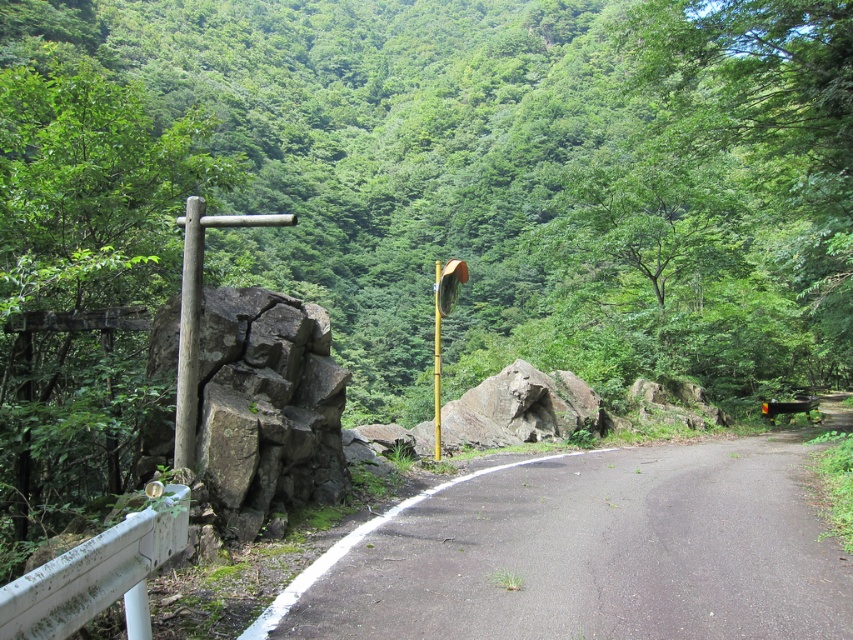
Question: Which of the following is the closest to the observer?

Choices:
 (A) (167, 348)
 (B) (439, 268)

Answer: (A)

Question: Among these objects, which one is nearest to the camera?

Choices:
 (A) smooth wooden post at left
 (B) black asphalt road at center

Answer: (B)

Question: Is brown wooden pole at left positioned before smooth wooden post at left?

Choices:
 (A) yes
 (B) no

Answer: (A)

Question: Can you confirm if black asphalt road at center is thinner than smooth wooden post at left?

Choices:
 (A) no
 (B) yes

Answer: (A)

Question: Can you confirm if brown wooden pole at left is positioned above smooth wooden post at left?

Choices:
 (A) no
 (B) yes

Answer: (B)

Question: Which point is closer to the camera taking this photo?

Choices:
 (A) (438, 321)
 (B) (194, 253)

Answer: (B)